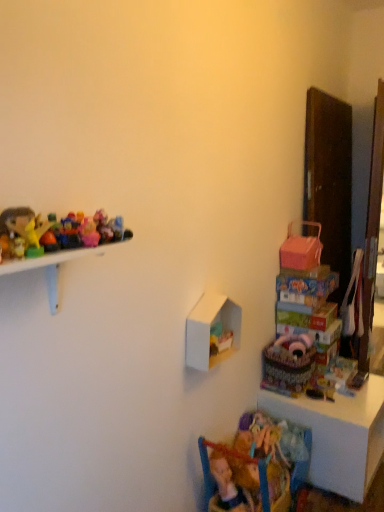
Describe the element at coordinates (236, 458) in the screenshot. I see `blue fabric chair at lower center` at that location.

What do you see at coordinates (23, 230) in the screenshot? I see `shiny plastic toys at left, the fourth toy in the back-to-front sequence` at bounding box center [23, 230].

What do you see at coordinates (209, 330) in the screenshot? I see `white matte shelf at center` at bounding box center [209, 330].

Find the location of `pink fabric stuffed animal at lower right, marked as the first toy in a bottom-to-top arrangement`. pink fabric stuffed animal at lower right, marked as the first toy in a bottom-to-top arrangement is located at coordinates (294, 344).

Identify the location of wooden toy box at lower right. (338, 435).

Locate an element on the screen. Image resolution: width=384 pixels, height=512 pixels. pink plastic doll at upper left, which appears as the third toy when viewed from the front is located at coordinates (89, 233).

The width and height of the screenshot is (384, 512). Describe the element at coordinates (89, 233) in the screenshot. I see `pink plastic doll at upper left, which appears as the third toy when viewed from the front` at that location.

The image size is (384, 512). What are the coordinates of `blue fabric chair at lower center` in the screenshot? It's located at (236, 458).

What are the coordinates of `the 2nd toy positioned above the textured fabric basket at lower right (from the image's perspective)` in the screenshot? It's located at (69, 233).

Could you measure the distance between translucent plastic toys at upper left, the second toy from the left, and textured fabric basket at lower right?

translucent plastic toys at upper left, the second toy from the left, is 5.13 feet away from textured fabric basket at lower right.

Looking at this image, is translucent plastic toys at upper left, the second toy from the left, not close to textured fabric basket at lower right?

Yes.

Considering the sizes of translucent plastic toys at upper left, the second toy ordered from the bottom, and textured fabric basket at lower right in the image, is translucent plastic toys at upper left, the second toy ordered from the bottom, wider or thinner than textured fabric basket at lower right?

Clearly, translucent plastic toys at upper left, the second toy ordered from the bottom, has less width compared to textured fabric basket at lower right.

Does shiny plastic toys at left, which ranks as the 1th toy in left-to-right order, have a larger size compared to translucent plastic toys at upper left, acting as the 3th toy starting from the right?

Correct, shiny plastic toys at left, which ranks as the 1th toy in left-to-right order, is larger in size than translucent plastic toys at upper left, acting as the 3th toy starting from the right.

Considering the positions of point (3, 243) and point (62, 246), is point (3, 243) closer or farther from the camera than point (62, 246)?

Clearly, point (3, 243) is closer to the camera than point (62, 246).

Which object is thinner, shiny plastic toys at left, which ranks as the 1th toy in left-to-right order, or translucent plastic toys at upper left, the second toy ordered from the bottom?

translucent plastic toys at upper left, the second toy ordered from the bottom.

Does translucent plastic toys at upper left, the third toy positioned from the back, have a lesser height compared to shiny plastic toys at left, which ranks as the 1th toy in left-to-right order?

Yes.

Is shiny plastic toys at left, which ranks as the 1th toy in left-to-right order, located within translucent plastic toys at upper left, the second toy ordered from the bottom?

No, translucent plastic toys at upper left, the second toy ordered from the bottom, does not contain shiny plastic toys at left, which ranks as the 1th toy in left-to-right order.

Looking at their sizes, would you say translucent plastic toys at upper left, which is counted as the 3th toy, starting from the top, is wider or thinner than shiny plastic toys at left, arranged as the third toy when ordered from the bottom?

In the image, translucent plastic toys at upper left, which is counted as the 3th toy, starting from the top, appears to be more narrow than shiny plastic toys at left, arranged as the third toy when ordered from the bottom.

Is pink fabric stuffed animal at lower right, the first toy in the right-to-left sequence, far from wooden toy box at lower right?

No.

Considering the positions of objects pink fabric stuffed animal at lower right, the first toy positioned from the back, and wooden toy box at lower right in the image provided, who is behind, pink fabric stuffed animal at lower right, the first toy positioned from the back, or wooden toy box at lower right?

pink fabric stuffed animal at lower right, the first toy positioned from the back.

Is pink fabric stuffed animal at lower right, marked as the first toy in a bottom-to-top arrangement, completely or partially outside of wooden toy box at lower right?

That's correct, pink fabric stuffed animal at lower right, marked as the first toy in a bottom-to-top arrangement, is outside of wooden toy box at lower right.

Where is `table below the pink fabric stuffed animal at lower right, marked as the first toy in a bottom-to-top arrangement (from a real-world perspective)`? Image resolution: width=384 pixels, height=512 pixels. table below the pink fabric stuffed animal at lower right, marked as the first toy in a bottom-to-top arrangement (from a real-world perspective) is located at coordinates (338, 435).

This screenshot has height=512, width=384. In order to click on toy that is the 3rd object located in front of the pink fabric stuffed animal at lower right, which ranks as the fourth toy in left-to-right order in this screenshot , I will do `click(23, 230)`.

Is point (29, 233) positioned behind point (277, 344)?

No, it is in front of (277, 344).

Considering the relative sizes of shiny plastic toys at left, which ranks as the 1th toy in left-to-right order, and pink fabric stuffed animal at lower right, the first toy in the right-to-left sequence, in the image provided, is shiny plastic toys at left, which ranks as the 1th toy in left-to-right order, wider than pink fabric stuffed animal at lower right, the first toy in the right-to-left sequence,?

In fact, shiny plastic toys at left, which ranks as the 1th toy in left-to-right order, might be narrower than pink fabric stuffed animal at lower right, the first toy in the right-to-left sequence.

Considering the positions of objects shiny plastic toys at left, which ranks as the 1th toy in left-to-right order, and pink fabric stuffed animal at lower right, the first toy positioned from the back, in the image provided, who is more to the left, shiny plastic toys at left, which ranks as the 1th toy in left-to-right order, or pink fabric stuffed animal at lower right, the first toy positioned from the back,?

Positioned to the left is shiny plastic toys at left, which ranks as the 1th toy in left-to-right order.

Is white matte shelf at center not near blue fabric chair at lower center?

white matte shelf at center is actually quite close to blue fabric chair at lower center.

From a real-world perspective, which object stands above the other?

white matte shelf at center, from a real-world perspective.

How distant is white matte shelf at center from blue fabric chair at lower center?

white matte shelf at center and blue fabric chair at lower center are 49.07 centimeters apart.

Could you tell me if white matte shelf at center is facing blue fabric chair at lower center?

No.

Can you tell me how much pink fabric stuffed animal at lower right, placed as the fourth toy when sorted from top to bottom, and blue fabric chair at lower center differ in facing direction?

The facing directions of pink fabric stuffed animal at lower right, placed as the fourth toy when sorted from top to bottom, and blue fabric chair at lower center are 80 degrees apart.

Does point (307, 340) come behind point (208, 475)?

Yes, it is.

Considering the positions of objects pink fabric stuffed animal at lower right, marked as the 4th toy in a front-to-back arrangement, and blue fabric chair at lower center in the image provided, who is behind, pink fabric stuffed animal at lower right, marked as the 4th toy in a front-to-back arrangement, or blue fabric chair at lower center?

Positioned behind is pink fabric stuffed animal at lower right, marked as the 4th toy in a front-to-back arrangement.

Is pink fabric stuffed animal at lower right, marked as the first toy in a bottom-to-top arrangement, located outside blue fabric chair at lower center?

Indeed, pink fabric stuffed animal at lower right, marked as the first toy in a bottom-to-top arrangement, is completely outside blue fabric chair at lower center.

This screenshot has width=384, height=512. In order to click on toy that is the 2nd object located in front of the textured fabric basket at lower right in this screenshot , I will do `click(69, 233)`.

Identify the location of toy on the left of translucent plastic toys at upper left, the second toy ordered from the bottom. This screenshot has width=384, height=512. (23, 230).

When comparing their distances from white matte shelf at center, does wooden toy box at lower right or pink fabric stuffed animal at lower right, which ranks as the fourth toy in left-to-right order, seem further?

wooden toy box at lower right is further to white matte shelf at center.

Consider the image. From the image, which object appears to be nearer to white matte shelf at center, pink fabric stuffed animal at lower right, marked as the 4th toy in a front-to-back arrangement, or shiny plastic toys at left, which ranks as the 4th toy in right-to-left order?

pink fabric stuffed animal at lower right, marked as the 4th toy in a front-to-back arrangement, is positioned closer to the anchor white matte shelf at center.

Based on their spatial positions, is pink plastic doll at upper left, positioned as the third toy in left-to-right order, or textured fabric basket at lower right closer to shiny plastic toys at left, which ranks as the 1th toy in left-to-right order?

Based on the image, pink plastic doll at upper left, positioned as the third toy in left-to-right order, appears to be nearer to shiny plastic toys at left, which ranks as the 1th toy in left-to-right order.

Considering their positions, is shiny plastic toys at left, which ranks as the 4th toy in right-to-left order, positioned closer to translucent plastic toys at upper left, the third toy positioned from the back, than textured fabric basket at lower right?

shiny plastic toys at left, which ranks as the 4th toy in right-to-left order, is closer to translucent plastic toys at upper left, the third toy positioned from the back.

When comparing their distances from blue fabric chair at lower center, does pink fabric stuffed animal at lower right, the first toy in the right-to-left sequence, or translucent plastic toys at upper left, which is counted as the 3th toy, starting from the top, seem closer?

The object closer to blue fabric chair at lower center is pink fabric stuffed animal at lower right, the first toy in the right-to-left sequence.

Consider the image. Estimate the real-world distances between objects in this image. Which object is closer to blue fabric chair at lower center, shiny plastic toys at left, which is counted as the first toy, starting from the front, or wooden toy box at lower right?

wooden toy box at lower right.

When comparing their distances from blue fabric chair at lower center, does pink plastic doll at upper left, placed as the second toy when sorted from back to front, or translucent plastic toys at upper left, the third toy positioned from the back, seem closer?

pink plastic doll at upper left, placed as the second toy when sorted from back to front.

Which object lies nearer to the anchor point pink plastic doll at upper left, which appears as the third toy when viewed from the front, white matte shelf at center or blue fabric chair at lower center?

white matte shelf at center is closer to pink plastic doll at upper left, which appears as the third toy when viewed from the front.

Identify the location of table that lies between pink plastic doll at upper left, positioned as the third toy in left-to-right order, and blue fabric chair at lower center from top to bottom. The height and width of the screenshot is (512, 384). (338, 435).

Locate an element on the screen. shelf between shiny plastic toys at left, which is counted as the first toy, starting from the front, and pink fabric stuffed animal at lower right, the first toy in the right-to-left sequence, along the z-axis is located at coordinates 209,330.

Find the location of a particular element. basket between pink fabric stuffed animal at lower right, marked as the first toy in a bottom-to-top arrangement, and blue fabric chair at lower center in the up-down direction is located at coordinates (287, 369).

The width and height of the screenshot is (384, 512). What are the coordinates of `toy between translucent plastic toys at upper left, which is counted as the 2th toy, starting from the front, and pink fabric stuffed animal at lower right, placed as the fourth toy when sorted from top to bottom, from front to back` in the screenshot? It's located at (89, 233).